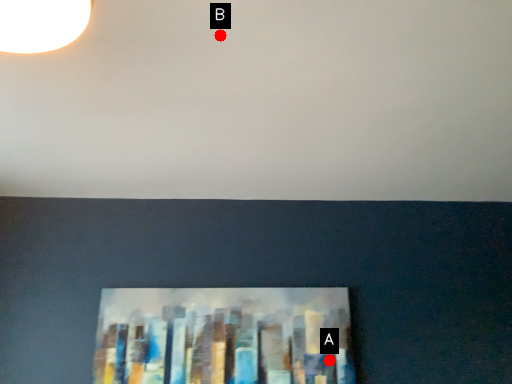
Question: Two points are circled on the image, labeled by A and B beside each circle. Which point is closer to the camera taking this photo?

Choices:
 (A) A is closer
 (B) B is closer

Answer: (B)